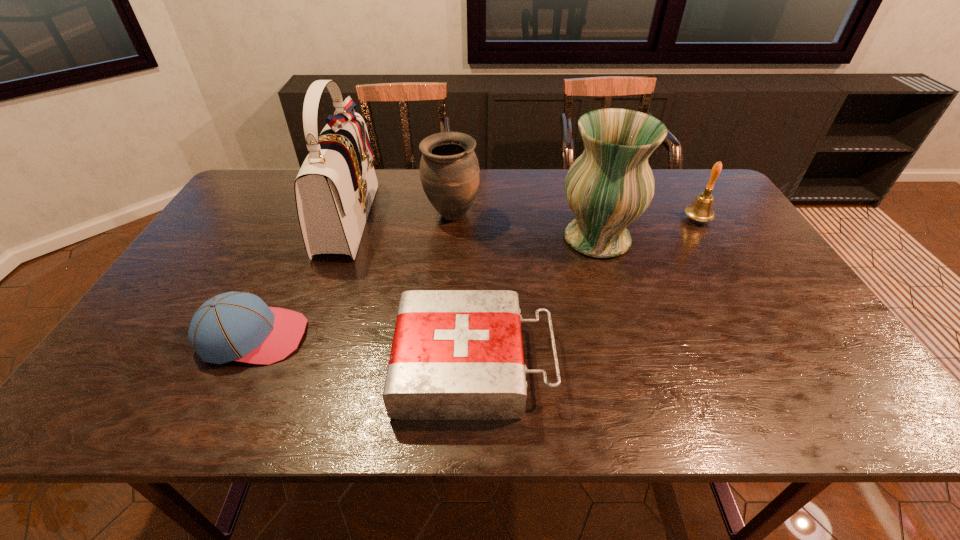
Locate an element on the screen. This screenshot has height=540, width=960. vacant region at the near edge is located at coordinates (754, 384).

Find the location of `free space between the shortest object and the rightmost object`. free space between the shortest object and the rightmost object is located at coordinates (586, 292).

Where is `free spot between the fifth shortest object and the first-aid kit`? The height and width of the screenshot is (540, 960). free spot between the fifth shortest object and the first-aid kit is located at coordinates (536, 301).

At what (x,y) coordinates should I click in order to perform the action: click on vacant point located between the fourth shortest object and the second shortest object. Please return your answer as a coordinate pair (x, y). This screenshot has height=540, width=960. Looking at the image, I should click on (352, 276).

The width and height of the screenshot is (960, 540). In order to click on free space between the urn and the second object from right to left in this screenshot , I will do `click(524, 227)`.

The image size is (960, 540). What are the coordinates of `free spot between the shortest object and the urn` in the screenshot? It's located at (463, 289).

The height and width of the screenshot is (540, 960). Find the location of `vacant area that lies between the tallest object and the baseball cap`. vacant area that lies between the tallest object and the baseball cap is located at coordinates (300, 277).

Where is `unoccupied area between the satchel and the urn`? This screenshot has width=960, height=540. unoccupied area between the satchel and the urn is located at coordinates (400, 217).

At what (x,y) coordinates should I click in order to perform the action: click on empty location between the urn and the vase. Please return your answer as a coordinate pair (x, y). Looking at the image, I should click on (524, 227).

Identify the location of vacant area between the rightmost object and the satchel. (523, 219).